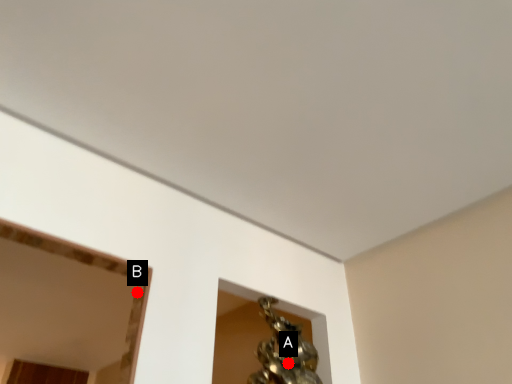
Question: Two points are circled on the image, labeled by A and B beside each circle. Which of the following is the closest to the observer?

Choices:
 (A) A is closer
 (B) B is closer

Answer: (B)